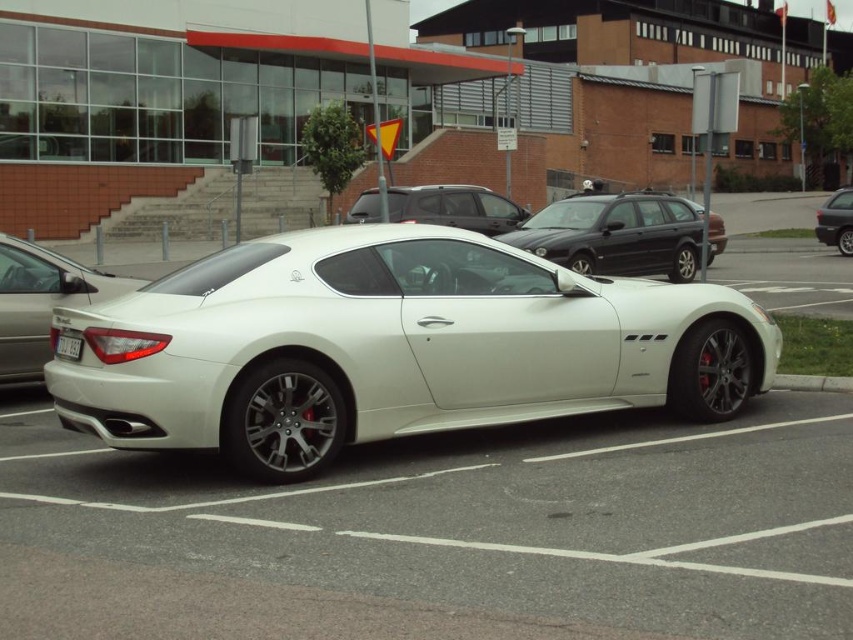
Question: Is satin black suv at upper center to the left of white plastic license plate at center from the viewer's perspective?

Choices:
 (A) no
 (B) yes

Answer: (A)

Question: Which object is positioned farthest from the satin white car at center?

Choices:
 (A) white metallic sports car at center
 (B) shiny black sedan at center

Answer: (B)

Question: Which object is closer to the camera taking this photo?

Choices:
 (A) glossy black station wagon at center
 (B) satin black suv at upper center
 (C) white metallic sports car at center
 (D) satin white car at center

Answer: (C)

Question: Among these objects, which one is nearest to the camera?

Choices:
 (A) satin black suv at upper center
 (B) white metallic sports car at center
 (C) satin white car at center

Answer: (B)

Question: Is glossy black station wagon at center thinner than satin black suv at upper center?

Choices:
 (A) yes
 (B) no

Answer: (A)

Question: Does satin black suv at upper center appear under white plastic license plate at center?

Choices:
 (A) yes
 (B) no

Answer: (B)